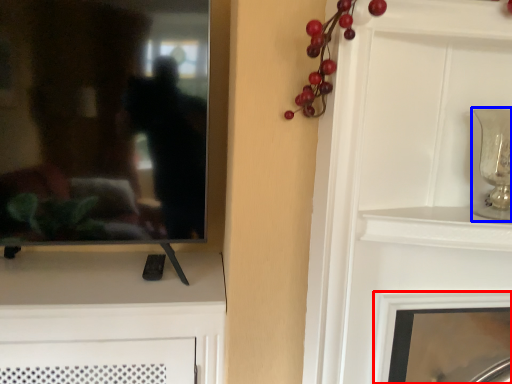
Question: Among these objects, which one is nearest to the camera, fireplace (highlighted by a red box) or candle holder (highlighted by a blue box)?

Choices:
 (A) fireplace
 (B) candle holder

Answer: (B)